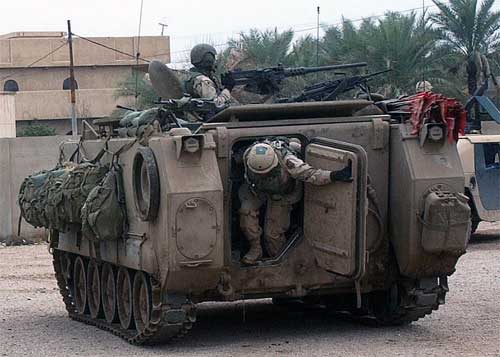
Image resolution: width=500 pixels, height=357 pixels. I want to click on window, so [x=13, y=88], [x=67, y=84].